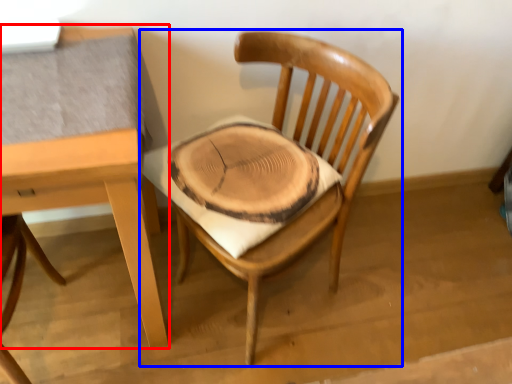
Question: Which point is closer to the camera, table (highlighted by a red box) or chair (highlighted by a blue box)?

Choices:
 (A) table
 (B) chair

Answer: (A)